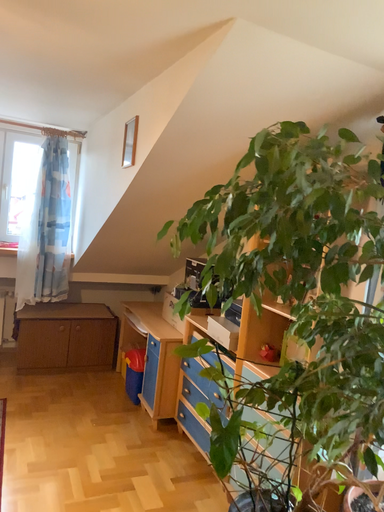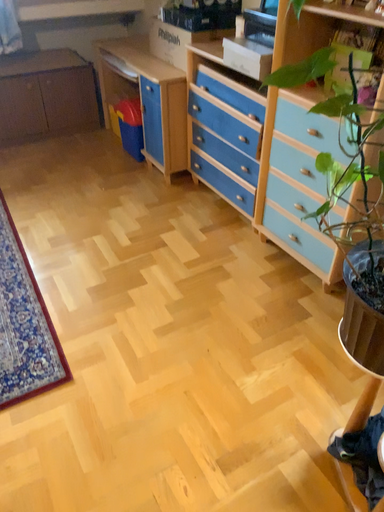
Question: How did the camera likely rotate when shooting the video?

Choices:
 (A) rotated downward
 (B) rotated upward

Answer: (A)